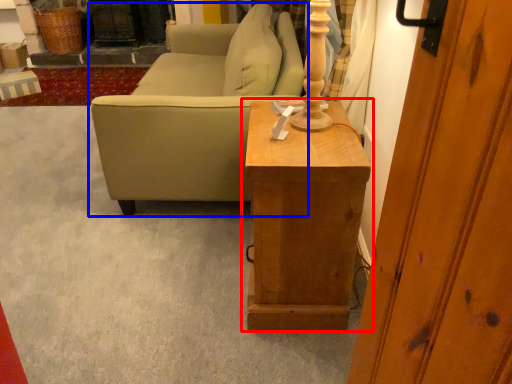
Question: Which point is closer to the camera, table (highlighted by a red box) or studio couch (highlighted by a blue box)?

Choices:
 (A) table
 (B) studio couch

Answer: (A)